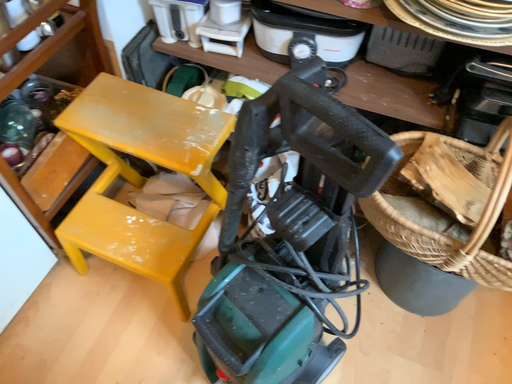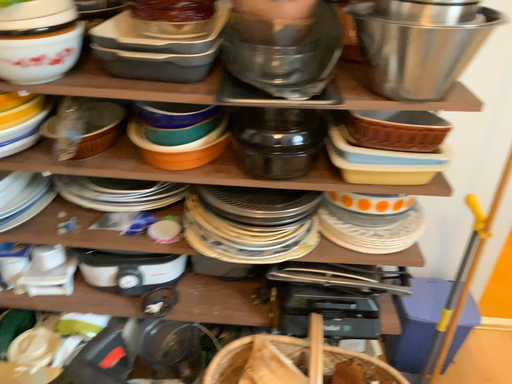
Question: Which way did the camera rotate in the video?

Choices:
 (A) rotated right
 (B) rotated left

Answer: (A)